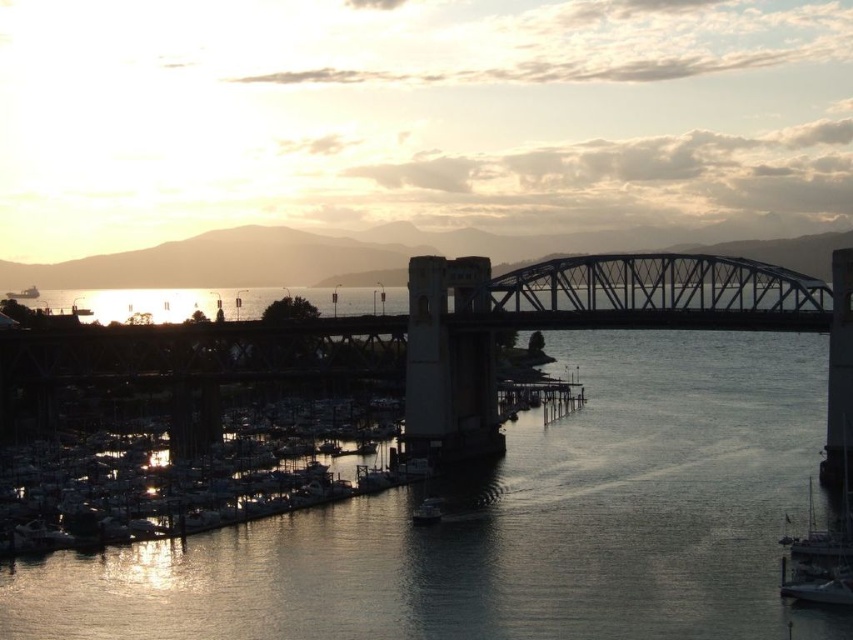
Question: Which point is farther from the camera taking this photo?

Choices:
 (A) (364, 541)
 (B) (12, 532)
 (C) (418, 502)

Answer: (C)

Question: Does metallic silver boat at center have a greater width compared to metallic gray boat at left?

Choices:
 (A) yes
 (B) no

Answer: (B)

Question: Based on their relative distances, which object is farther from the metallic gray boat at left?

Choices:
 (A) dark gray concrete waterway at center
 (B) white matte boats at lower left

Answer: (A)

Question: Which point is farther from the camera taking this photo?

Choices:
 (A) (695, 371)
 (B) (21, 296)
 (C) (39, 525)
 (D) (440, 504)

Answer: (B)

Question: Does metallic silver boat at center have a greater width compared to metallic gray boat at left?

Choices:
 (A) no
 (B) yes

Answer: (A)

Question: Is dark gray concrete waterway at center closer to the viewer compared to metallic silver boat at center?

Choices:
 (A) no
 (B) yes

Answer: (B)